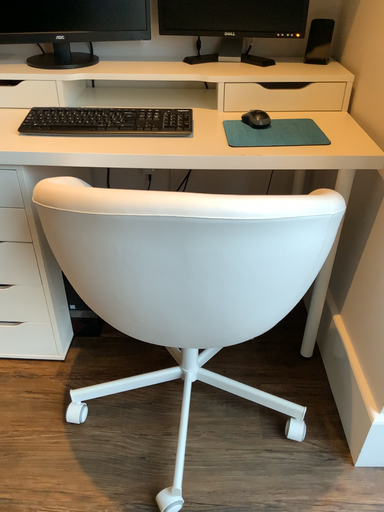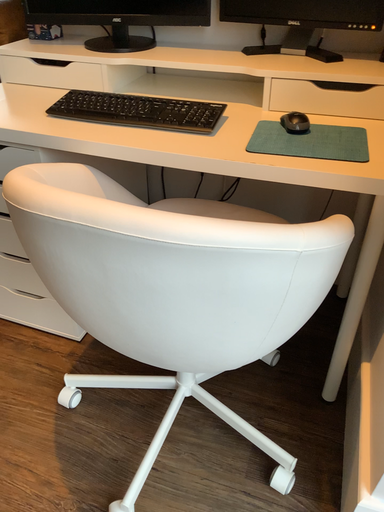
Question: How did the camera likely rotate when shooting the video?

Choices:
 (A) rotated left
 (B) rotated right

Answer: (A)